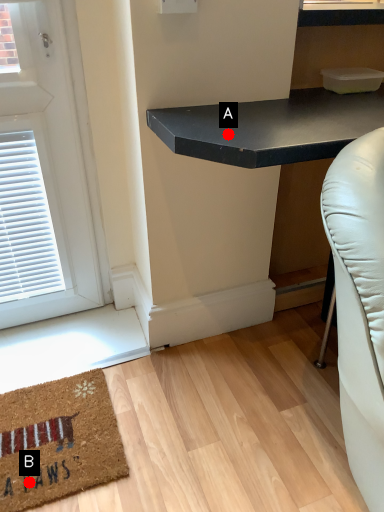
Question: Two points are circled on the image, labeled by A and B beside each circle. Among these points, which one is farthest from the camera?

Choices:
 (A) A is further
 (B) B is further

Answer: (B)